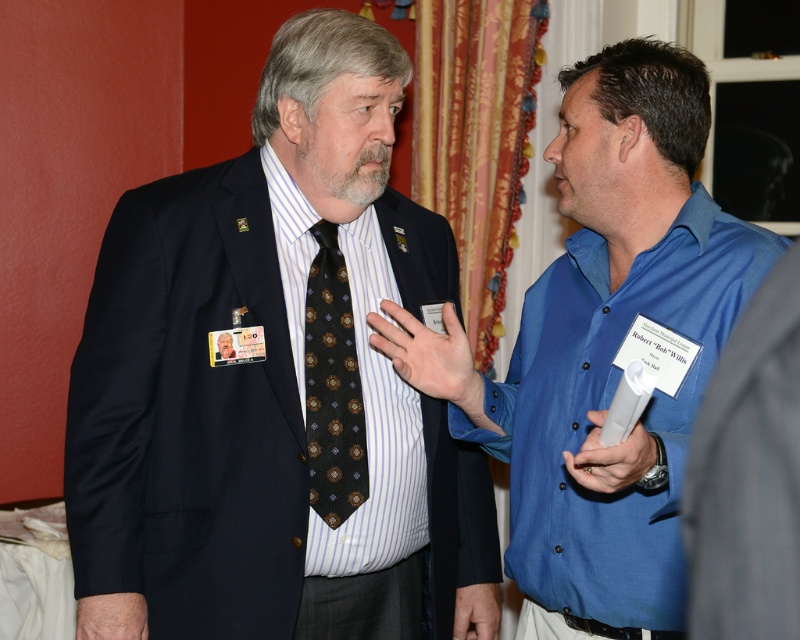
Question: Is blue button-down shirt at center closer to camera compared to dark brown silk tie at center?

Choices:
 (A) no
 (B) yes

Answer: (B)

Question: Which of these objects is positioned closest to the matte black suit at center?

Choices:
 (A) dark brown silk tie at center
 (B) blue button-down shirt at center
 (C) striped cotton shirt at left

Answer: (C)

Question: Can you confirm if striped cotton shirt at left is positioned to the right of dark brown silk tie at center?

Choices:
 (A) yes
 (B) no

Answer: (A)

Question: Which object appears farthest from the camera in this image?

Choices:
 (A) striped cotton shirt at left
 (B) blue button-down shirt at center
 (C) matte black suit at center
 (D) dark brown silk tie at center

Answer: (D)

Question: Among these objects, which one is farthest from the camera?

Choices:
 (A) striped cotton shirt at left
 (B) blue button-down shirt at center
 (C) dark brown silk tie at center
 (D) matte black suit at center

Answer: (C)

Question: Is blue button-down shirt at center bigger than striped cotton shirt at left?

Choices:
 (A) no
 (B) yes

Answer: (B)